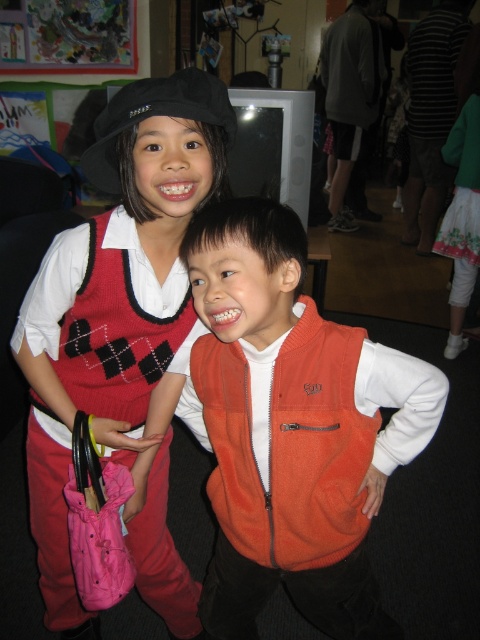
Question: Which point is closer to the camera taking this photo?

Choices:
 (A) (371, 440)
 (B) (84, 244)
 (C) (326, 458)
 (D) (40, 520)

Answer: (C)

Question: Is orange fleece safety vest at center to the left of knitted argyle sweater vest at left from the viewer's perspective?

Choices:
 (A) yes
 (B) no

Answer: (B)

Question: Is orange fleece vest at center to the right of knitted sweater vest at center from the viewer's perspective?

Choices:
 (A) yes
 (B) no

Answer: (A)

Question: From the image, what is the correct spatial relationship of orange fleece safety vest at center in relation to knitted argyle sweater vest at left?

Choices:
 (A) left
 (B) right

Answer: (B)

Question: Which point appears closest to the camera in this image?

Choices:
 (A) (115, 340)
 (B) (370, 460)
 (C) (122, 248)
 (D) (229, 632)

Answer: (C)

Question: Which point is closer to the camera?

Choices:
 (A) (184, 301)
 (B) (355, 561)
 (C) (56, 372)

Answer: (A)